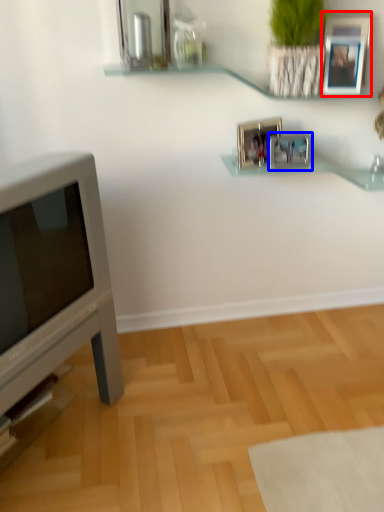
Question: Which of the following is the farthest to the observer, picture frame (highlighted by a red box) or picture frame (highlighted by a blue box)?

Choices:
 (A) picture frame
 (B) picture frame

Answer: (B)